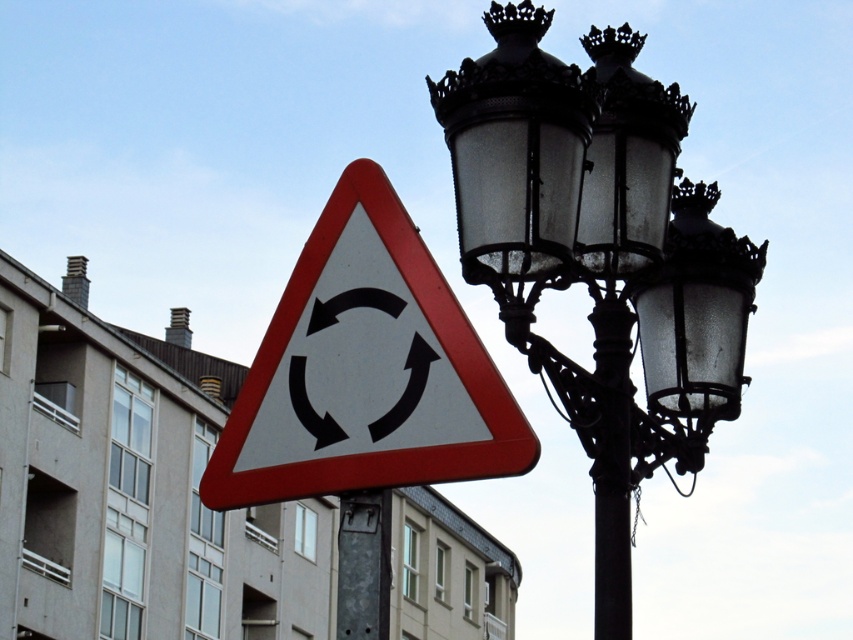
Question: Is the position of white plastic triangle at center more distant than that of metallic gray pole at center?

Choices:
 (A) no
 (B) yes

Answer: (A)

Question: Is matte glass streetlamp at upper right wider than metallic gray pole at center?

Choices:
 (A) yes
 (B) no

Answer: (A)

Question: Which point is closer to the camera?

Choices:
 (A) (387, 605)
 (B) (467, 268)
 (C) (318, 220)

Answer: (A)

Question: Which point is farther to the camera?

Choices:
 (A) black wrought iron streetlight at upper right
 (B) metallic gray pole at center

Answer: (A)

Question: Which of the following is the closest to the observer?

Choices:
 (A) matte glass streetlamp at upper right
 (B) black wrought iron streetlight at upper right

Answer: (B)

Question: Is white plastic triangle at center to the left of metallic gray pole at center from the viewer's perspective?

Choices:
 (A) no
 (B) yes

Answer: (B)